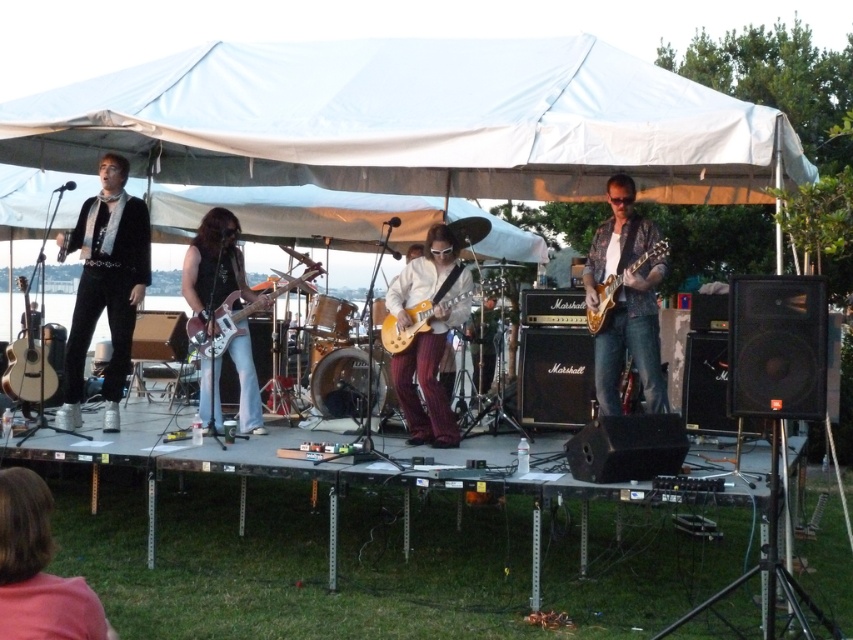
Question: Can you confirm if shiny brown leather guitar at center is positioned below wooden electric guitar at center?

Choices:
 (A) yes
 (B) no

Answer: (A)

Question: Among these points, which one is nearest to the camera?

Choices:
 (A) (431, 317)
 (B) (9, 388)
 (C) (91, 234)
 (D) (19, 604)

Answer: (D)

Question: Which point is closer to the camera?

Choices:
 (A) (218, 280)
 (B) (645, 321)
 (C) (86, 296)

Answer: (B)

Question: Does wooden electric guitar at center appear on the right side of matte white acoustic guitar at left?

Choices:
 (A) no
 (B) yes

Answer: (B)

Question: Is pink fabric at lower left to the right of wooden electric guitar at center from the viewer's perspective?

Choices:
 (A) no
 (B) yes

Answer: (B)

Question: Which point is closer to the camera?

Choices:
 (A) yellow matte electric guitar at center
 (B) pink fabric at lower left
 (C) glossy electric guitar at center

Answer: (B)